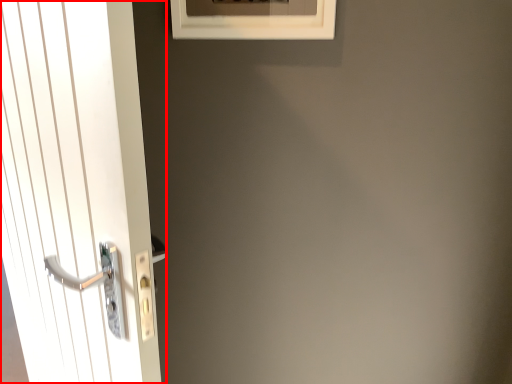
Question: In this image, where is door (annotated by the red box) located relative to window?

Choices:
 (A) left
 (B) right

Answer: (A)